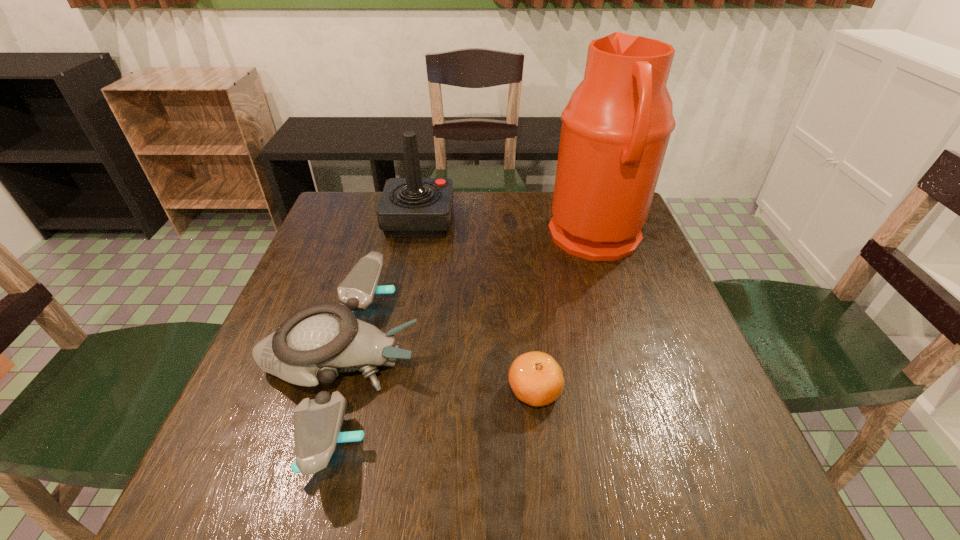
I want to click on free space at the near edge of the desktop, so coord(615,467).

Where is `free space at the left edge of the desktop`? free space at the left edge of the desktop is located at coordinates (300, 310).

In order to click on vacant space at the right edge of the desktop in this screenshot , I will do `click(614, 279)`.

At what (x,y) coordinates should I click in order to perform the action: click on vacant area at the far left corner. Please return your answer as a coordinate pair (x, y). Looking at the image, I should click on (353, 232).

At what (x,y) coordinates should I click in order to perform the action: click on vacant space at the near left corner. Please return your answer as a coordinate pair (x, y). Image resolution: width=960 pixels, height=540 pixels. Looking at the image, I should click on point(212,476).

Locate an element on the screen. vacant space at the near right corner of the desktop is located at coordinates (x=747, y=498).

I want to click on free space that is in between the second shortest object and the third object from left to right, so click(437, 377).

Where is `vacant area between the rightmost object and the drone`? The image size is (960, 540). vacant area between the rightmost object and the drone is located at coordinates (468, 301).

Locate an element on the screen. The width and height of the screenshot is (960, 540). vacant point located between the water jug and the drone is located at coordinates (468, 301).

Identify the location of free spot between the shortest object and the second tallest object. (476, 306).